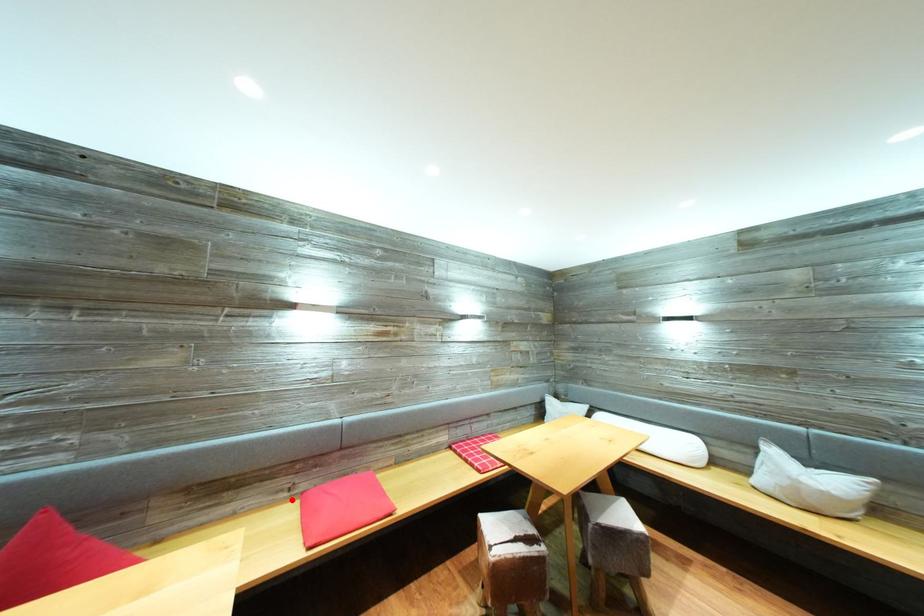
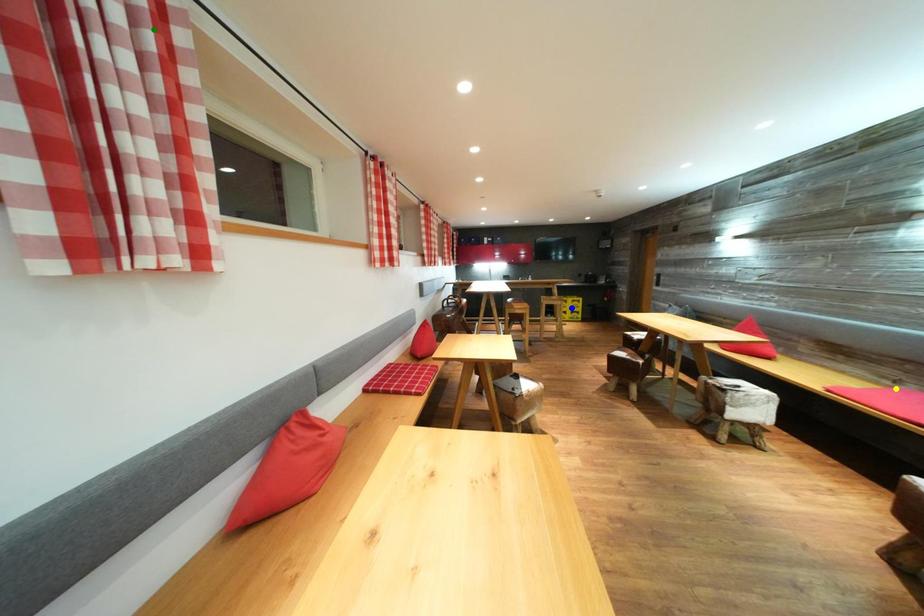
Question: I am providing you with two images of the same scene from different viewpoints. A red point is marked on the first image. You are given multiple points on the second image. Which point in image 2 is actually the same real-world point as the red point in image 1?

Choices:
 (A) blue point
 (B) yellow point
 (C) green point

Answer: (B)